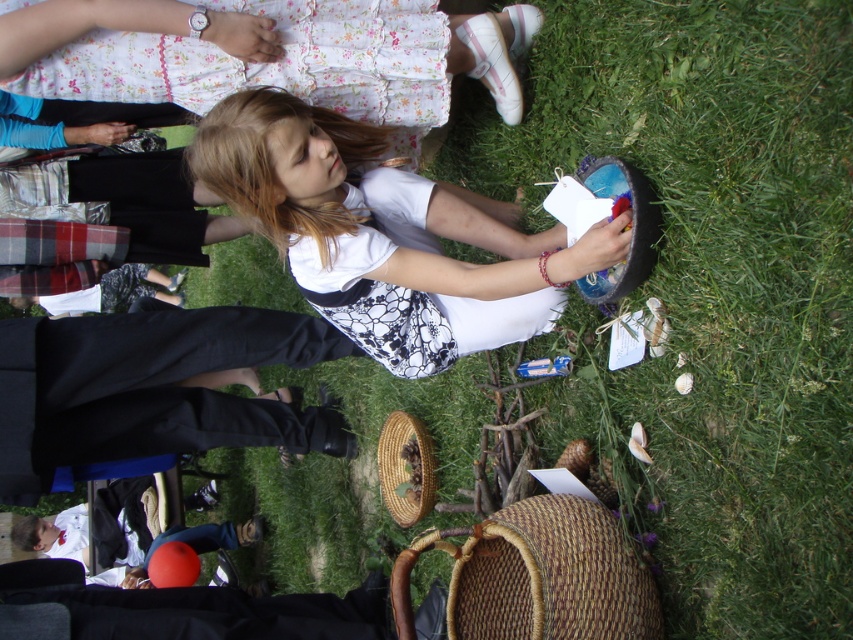
Is point (375, 296) farther from camera compared to point (397, 522)?

No, (375, 296) is closer to viewer.

Locate an element on the screen. This screenshot has width=853, height=640. white lace dress at center is located at coordinates (384, 236).

Between brown woven picnic basket at lower center and woven brown picnic basket at lower center, which one has less height?

brown woven picnic basket at lower center is shorter.

Between brown woven picnic basket at lower center and woven brown picnic basket at lower center, which one has more height?

woven brown picnic basket at lower center

Which is behind, point (491, 612) or point (398, 413)?

Positioned behind is point (398, 413).

You are a GUI agent. You are given a task and a screenshot of the screen. Output one action in this format:
    pyautogui.click(x=<x>, y=<y>)
    Task: Click on the brown woven picnic basket at lower center
    Image resolution: width=853 pixels, height=640 pixels.
    Given the screenshot: What is the action you would take?
    pyautogui.click(x=538, y=577)

Is white lace dress at center shorter than brown woven picnic basket at lower center?

Incorrect, white lace dress at center's height does not fall short of brown woven picnic basket at lower center's.

Who is positioned more to the left, white lace dress at center or brown woven picnic basket at lower center?

white lace dress at center

Is point (346, 202) behind point (624, 548)?

Yes, it is behind point (624, 548).

Where is `white lace dress at center`? The height and width of the screenshot is (640, 853). white lace dress at center is located at coordinates (384, 236).